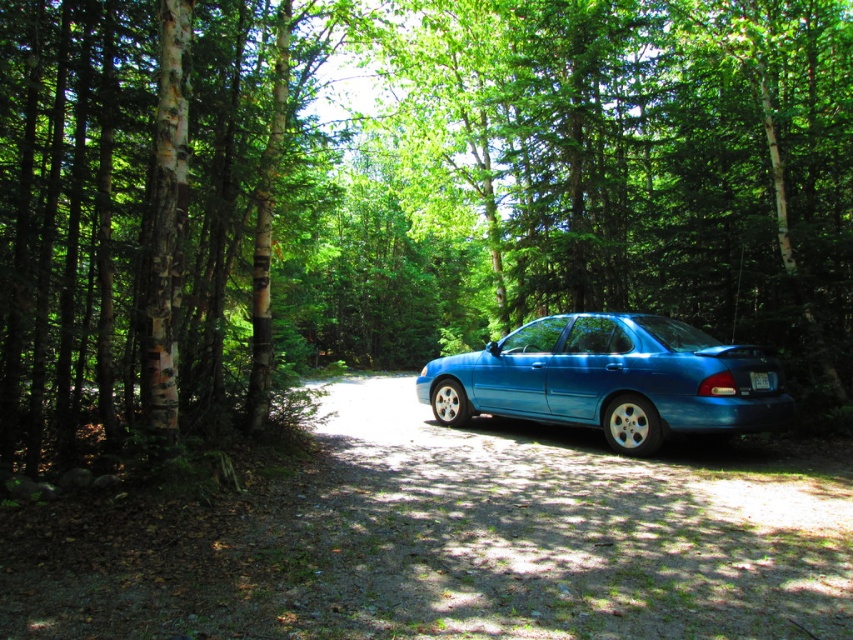
Question: Does glossy blue sedan at center have a greater width compared to white plastic license plate at rear?

Choices:
 (A) yes
 (B) no

Answer: (A)

Question: Is glossy blue sedan at center thinner than white plastic license plate at rear?

Choices:
 (A) no
 (B) yes

Answer: (A)

Question: Can you confirm if glossy blue sedan at center is positioned above white plastic license plate at rear?

Choices:
 (A) yes
 (B) no

Answer: (B)

Question: Which point is closer to the camera?

Choices:
 (A) white plastic license plate at rear
 (B) glossy blue sedan at center

Answer: (B)

Question: Which point is closer to the camera?

Choices:
 (A) (770, 374)
 (B) (751, 346)

Answer: (B)